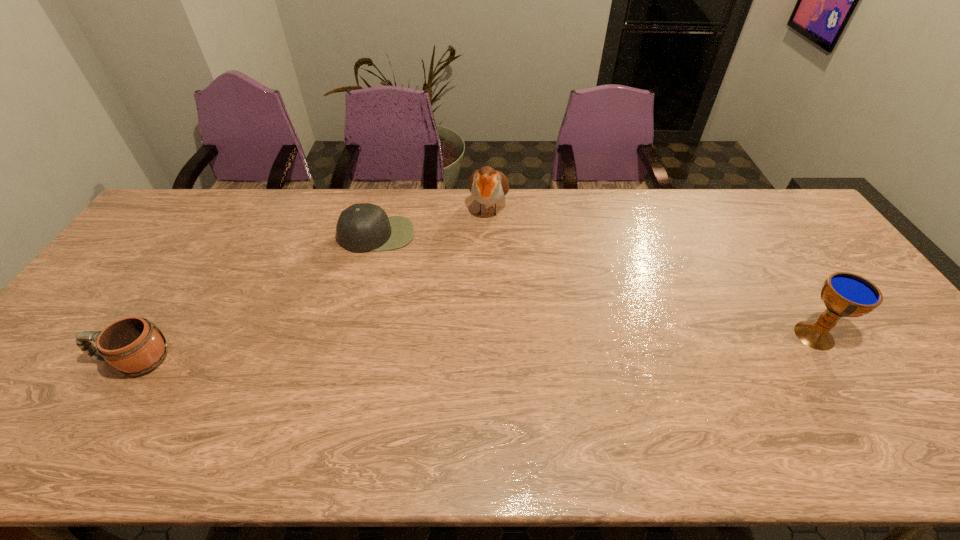
Choose which object is the nearest neighbor to the mug. Please provide its 2D coordinates. Your answer should be formatted as a tuple, i.e. [(x, y)], where the tuple contains the x and y coordinates of a point satisfying the conditions above.

[(363, 227)]

Point out which object is positioned as the third nearest to the mug. Please provide its 2D coordinates. Your answer should be formatted as a tuple, i.e. [(x, y)], where the tuple contains the x and y coordinates of a point satisfying the conditions above.

[(844, 294)]

At what (x,y) coordinates should I click in order to perform the action: click on vacant area that satisfies the following two spatial constraints: 1. on the back side of the third object from right to left; 2. on the right side of the second object from right to left. Please return your answer as a coordinate pair (x, y). Looking at the image, I should click on (384, 208).

The image size is (960, 540). In order to click on free space that satisfies the following two spatial constraints: 1. on the back side of the third object from left to right; 2. on the right side of the cap in this screenshot , I will do `click(384, 208)`.